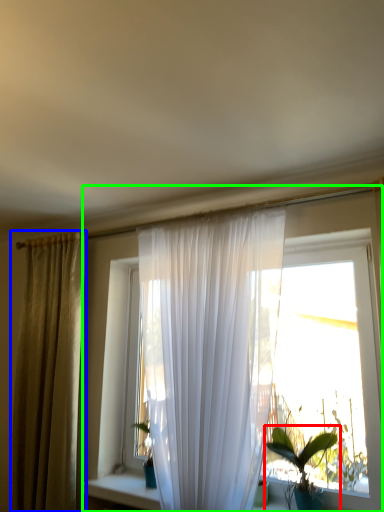
Question: Estimate the real-world distances between objects in this image. Which object is closer to houseplant (highlighted by a red box), curtain (highlighted by a blue box) or window (highlighted by a green box)?

Choices:
 (A) curtain
 (B) window

Answer: (B)